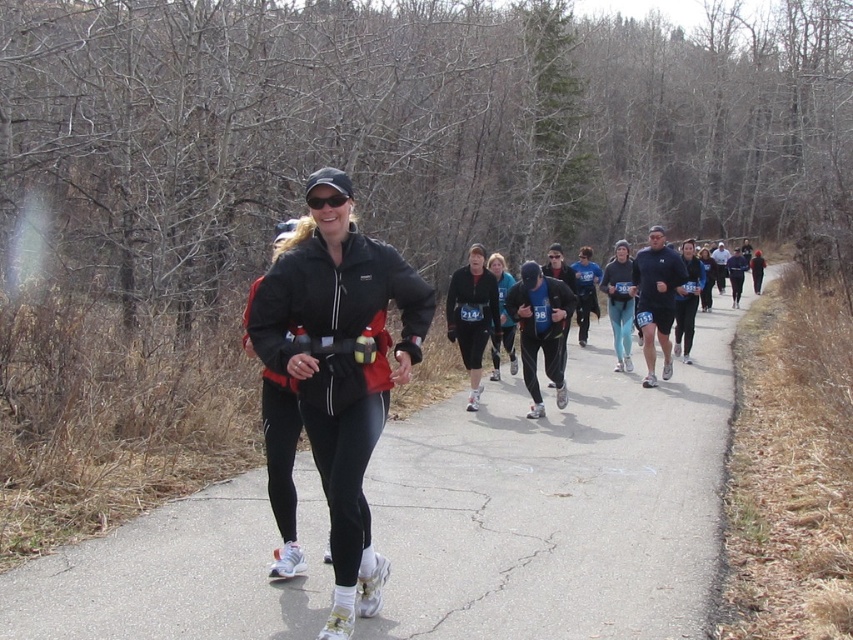
You are a photographer at the running event. You want to capture a photo that includes both the black fabric runner at center and the blue fabric running outfit at center. Which of the two will appear smaller in the photo?

The black fabric runner at center will appear smaller in the photo because it occupies less space than the blue fabric running outfit at center.

You are a photographer at the running event. You need to capture a photo of both the black fabric runner at center and the blue fabric running outfit at center in the same frame. Based on their positions, which runner should you position your camera to the right of to include both in the shot?

The black fabric runner at center is to the left of blue fabric running outfit at center. To include both in the same frame, position your camera to the right of the black fabric runner at center so that the blue fabric running outfit at center is on its right side and both are visible.

In the scene shown: You are a photographer at the running event and want to capture a photo of the blue fabric running outfit at center and the matte black jacket at center. Which object should you focus on if you want to highlight the taller one?

The blue fabric running outfit at center is taller than the matte black jacket at center, so you should focus on the blue fabric running outfit at center to highlight the taller one.